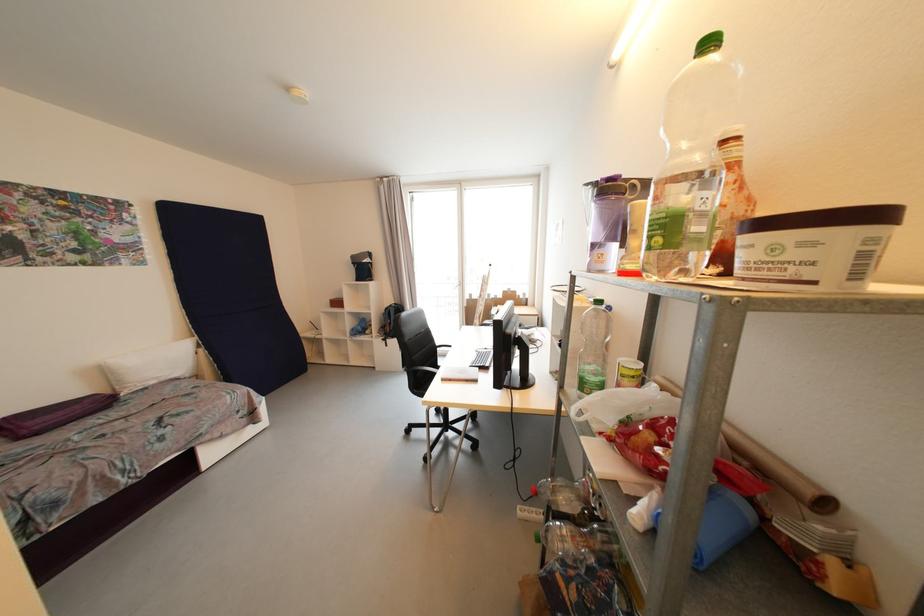
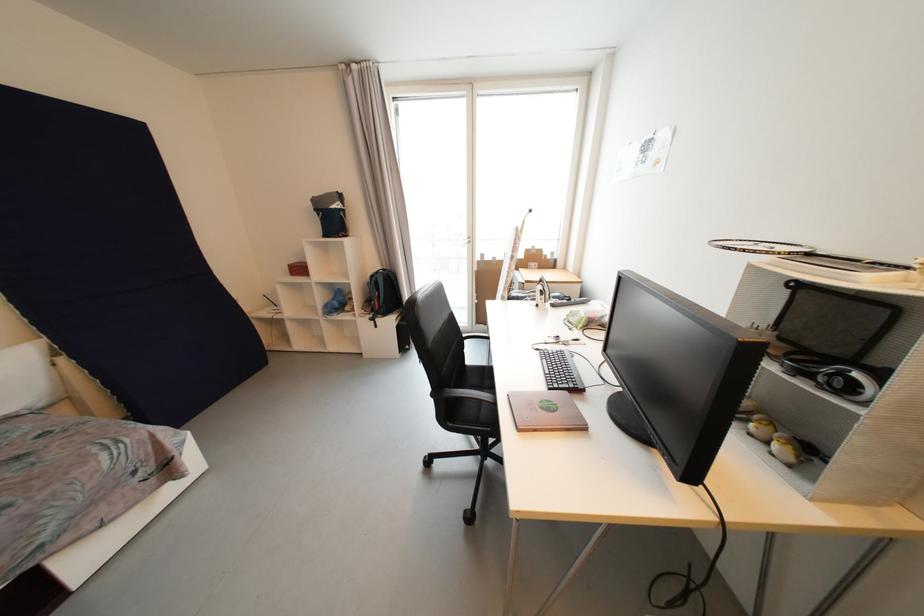
Which direction would the cameraman need to move to produce the second image?

The movement direction of the cameraman is left, forward.